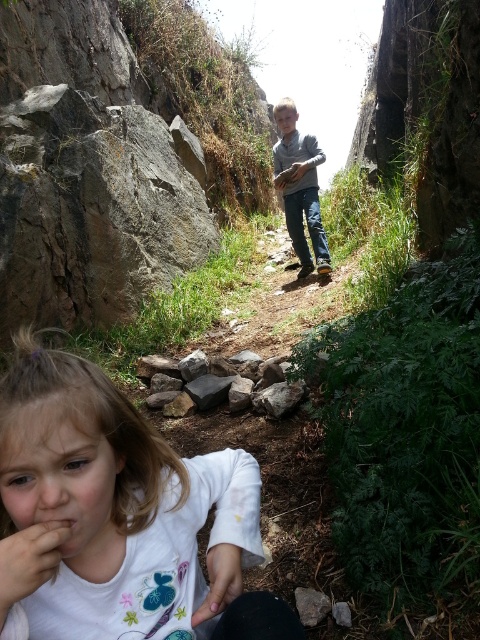
Find the location of a particular element. Image resolution: width=480 pixels, height=640 pixels. white soft shirt at lower left is located at coordinates (118, 516).

Can you confirm if white soft shirt at lower left is positioned above smooth skin hand at center?

Incorrect, white soft shirt at lower left is not positioned above smooth skin hand at center.

Does point (157, 561) come closer to viewer compared to point (296, 176)?

That is True.

Where is `white soft shirt at lower left`? Image resolution: width=480 pixels, height=640 pixels. white soft shirt at lower left is located at coordinates (118, 516).

Does smooth skin hand at lower left have a lesser width compared to smooth skin hand at center?

Yes.

The height and width of the screenshot is (640, 480). What do you see at coordinates (28, 561) in the screenshot?
I see `smooth skin hand at lower left` at bounding box center [28, 561].

Identify the location of smooth skin hand at lower left. (28, 561).

Is point (276, 364) farther from camera compared to point (46, 566)?

Yes.

Between gray rock at center and smooth skin hand at lower left, which one has less height?

smooth skin hand at lower left

Does point (153, 364) come farther from viewer compared to point (69, 529)?

Yes, it is.

The width and height of the screenshot is (480, 640). Find the location of `gray rock at center`. gray rock at center is located at coordinates (251, 392).